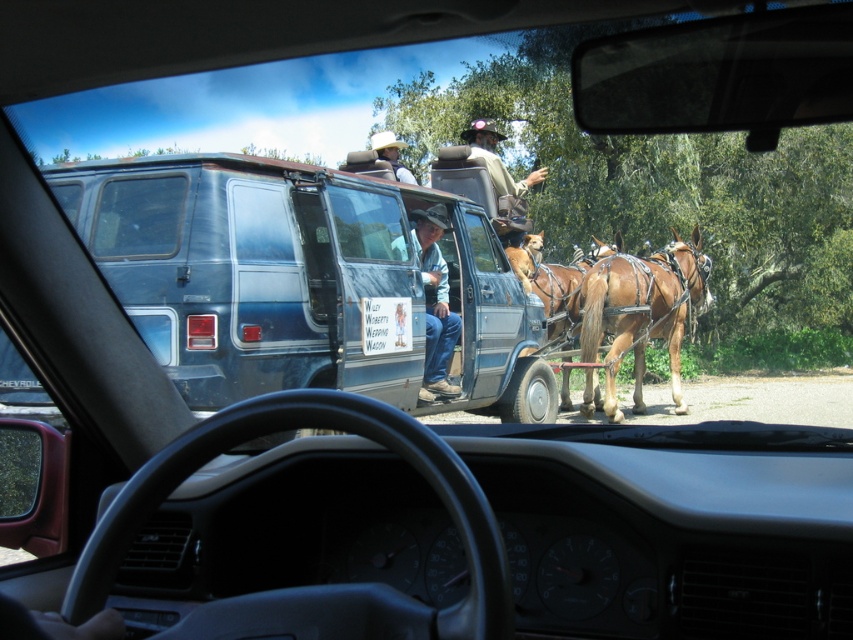
You are a passenger in the vehicle and notice two brown glossy horses in the scene. Which horse, the brown glossy horse at center or the brown glossy horse at right, is closer to the left side of the vehicle?

The brown glossy horse at right is closer to the left side of the vehicle because the brown glossy horse at center is positioned on the right side of it.

You are driving a car and want to pass the blue metallic van at center and the brown glossy horse at center on a narrow road. Which one should you pass first according to their widths?

The blue metallic van at center might be wider than brown glossy horse at center, so you should pass the brown glossy horse at center first to ensure safety.